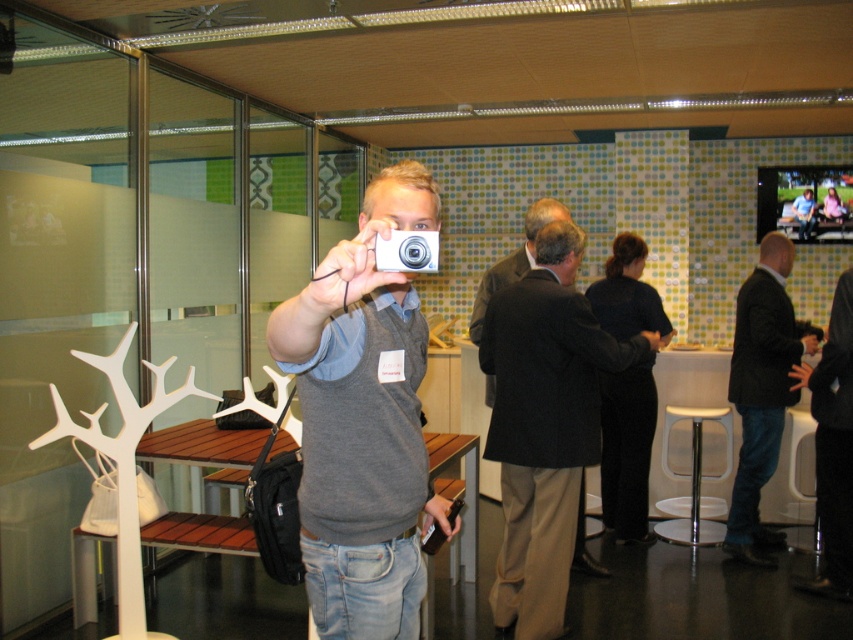
Does point (416, 481) come behind point (520, 296)?

No.

Can you confirm if matte silver camera at center is bigger than dark brown suit at center?

Correct, matte silver camera at center is larger in size than dark brown suit at center.

Between point (322, 568) and point (556, 518), which one is positioned behind?

Point (556, 518)

Locate an element on the screen. The width and height of the screenshot is (853, 640). matte silver camera at center is located at coordinates (363, 420).

Can you confirm if dark brown suit at center is positioned to the left of silver metallic camera at center?

No, dark brown suit at center is not to the left of silver metallic camera at center.

Is dark brown suit at center to the right of silver metallic camera at center from the viewer's perspective?

Correct, you'll find dark brown suit at center to the right of silver metallic camera at center.

This screenshot has height=640, width=853. What do you see at coordinates (544, 424) in the screenshot?
I see `dark brown suit at center` at bounding box center [544, 424].

Identify the location of dark brown suit at center. Image resolution: width=853 pixels, height=640 pixels. (544, 424).

Locate an element on the screen. The image size is (853, 640). dark brown leather jacket at right is located at coordinates (762, 392).

Does dark brown leather jacket at right have a greater height compared to white plastic stool at lower right?

Correct, dark brown leather jacket at right is much taller as white plastic stool at lower right.

Does point (734, 378) lie behind point (668, 408)?

No.

The width and height of the screenshot is (853, 640). Find the location of `dark brown leather jacket at right`. dark brown leather jacket at right is located at coordinates (762, 392).